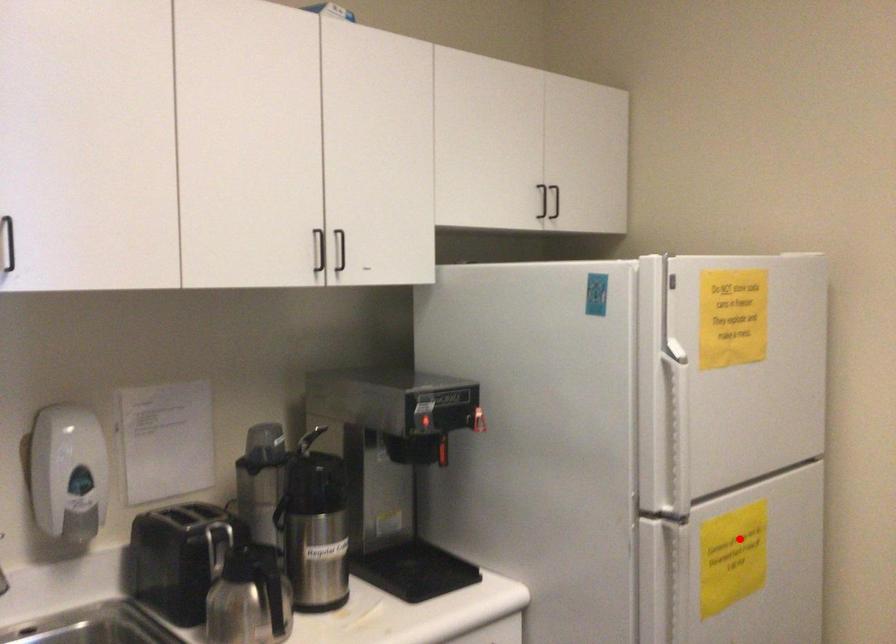
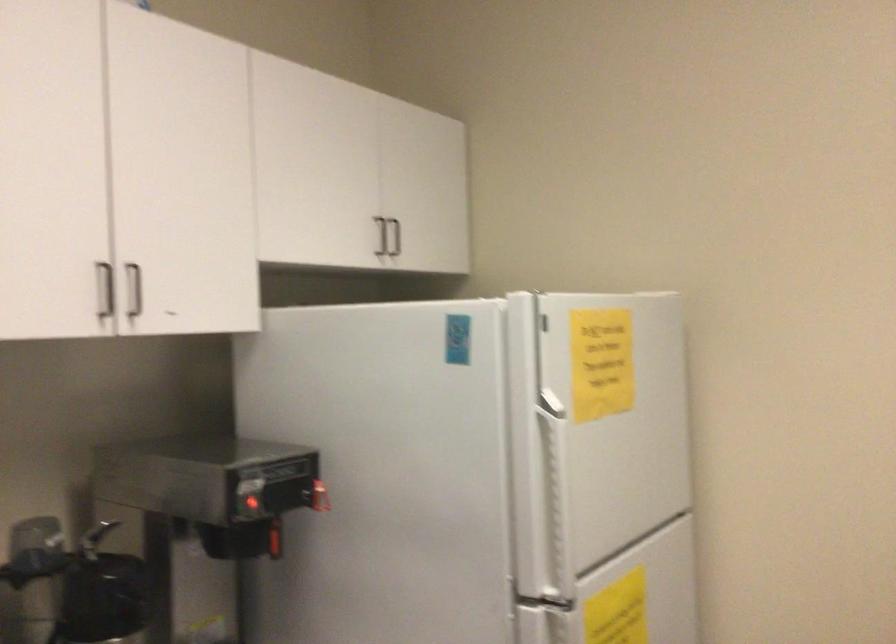
The point at the highlighted location is marked in the first image. Where is the corresponding point in the second image?

(617, 611)